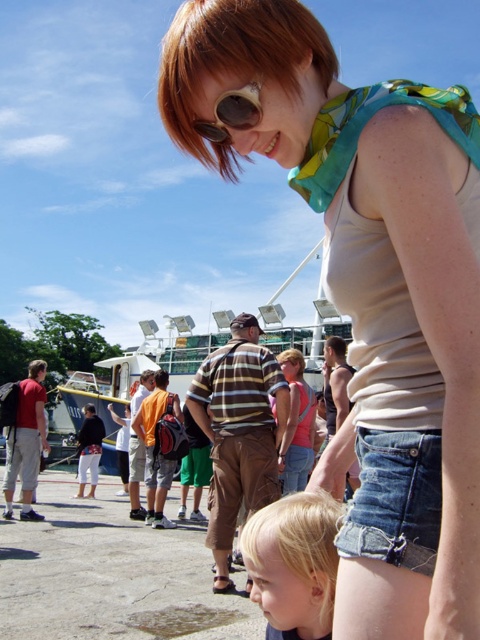
In the scene described, there is a woman wearing a sleeveless beige top at the center. What object is located exactly at the coordinates point (371, 289)?

The point (371, 289) corresponds to the matte beige tank top at center.